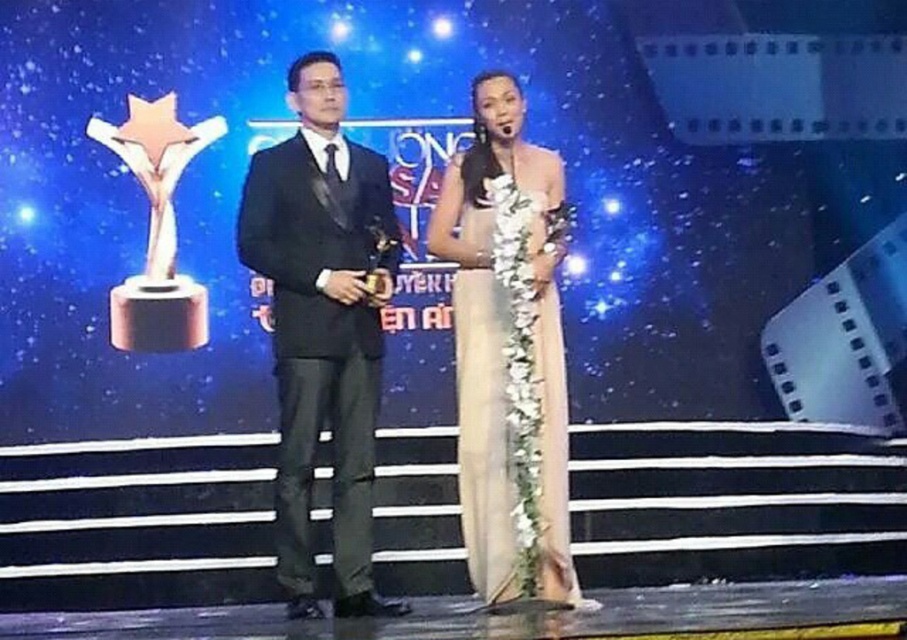
Question: Can you confirm if black satin suit at center is positioned below satin beige dress at center?

Choices:
 (A) no
 (B) yes

Answer: (A)

Question: Can you confirm if black satin suit at center is positioned to the left of satin beige dress at center?

Choices:
 (A) yes
 (B) no

Answer: (A)

Question: Which point is farther from the camera taking this photo?

Choices:
 (A) (554, 397)
 (B) (288, 410)

Answer: (A)

Question: Which object is farther from the camera taking this photo?

Choices:
 (A) black satin suit at center
 (B) satin beige dress at center

Answer: (B)

Question: Which point is farther to the camera?

Choices:
 (A) black satin suit at center
 (B) satin beige dress at center

Answer: (B)

Question: Is black satin suit at center in front of satin beige dress at center?

Choices:
 (A) no
 (B) yes

Answer: (B)